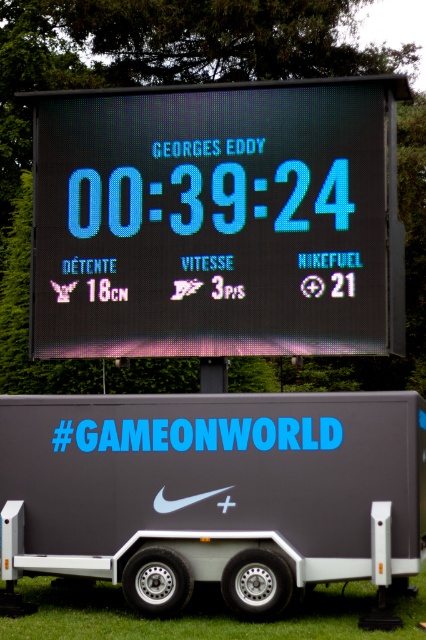
Question: Which point is farther from the camera taking this photo?

Choices:
 (A) (336, 573)
 (B) (98, 134)

Answer: (B)

Question: Is black led scoreboard at center positioned behind matte gray trailer at center?

Choices:
 (A) yes
 (B) no

Answer: (A)

Question: Is black led scoreboard at center closer to the viewer compared to matte gray trailer at center?

Choices:
 (A) no
 (B) yes

Answer: (A)

Question: Is black led scoreboard at center below matte gray trailer at center?

Choices:
 (A) no
 (B) yes

Answer: (A)